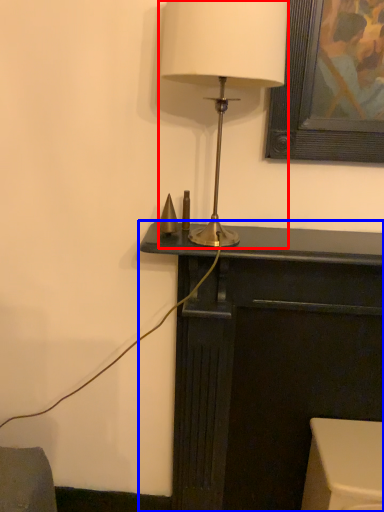
Question: Which object is closer to the camera taking this photo, lamp (highlighted by a red box) or furniture (highlighted by a blue box)?

Choices:
 (A) lamp
 (B) furniture

Answer: (A)